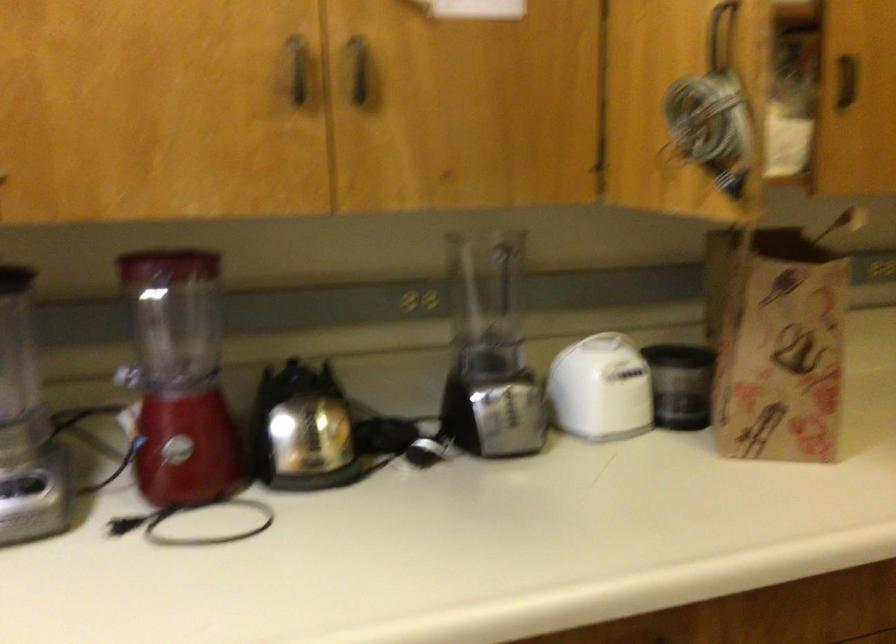
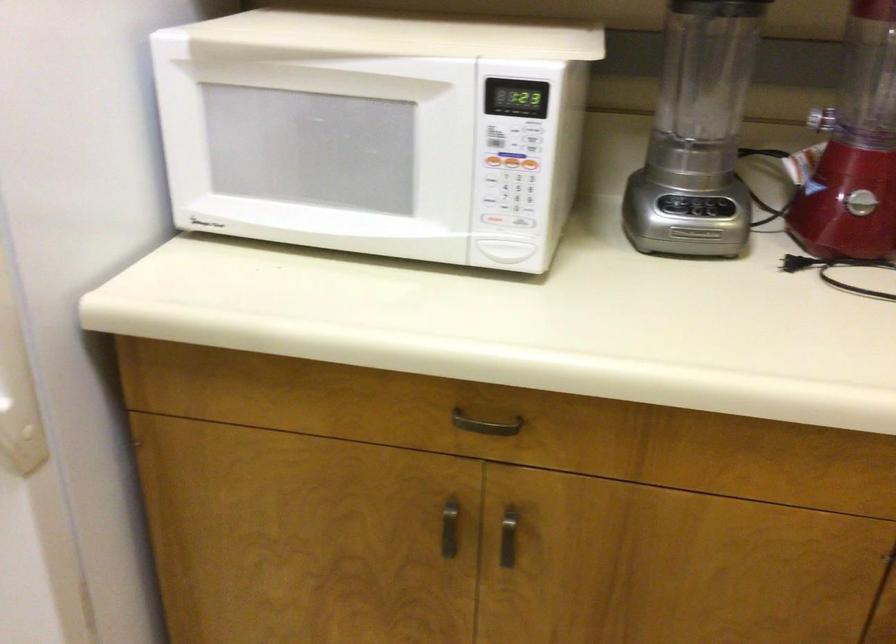
Based on the continuous images, in which direction is the camera rotating?

The camera's rotation is toward left-down.